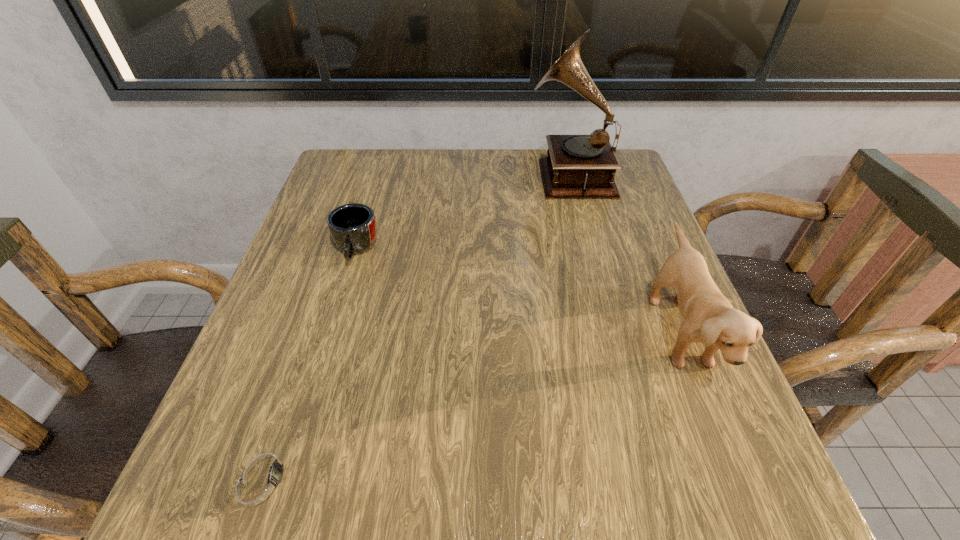
Where is `free space that satisfies the following two spatial constraints: 1. on the side of the mug with the handle; 2. on the face of the shortest object`? free space that satisfies the following two spatial constraints: 1. on the side of the mug with the handle; 2. on the face of the shortest object is located at coordinates (288, 476).

Where is `blank space that satisfies the following two spatial constraints: 1. on the horn of the record player; 2. on the side of the mug with the handle`? Image resolution: width=960 pixels, height=540 pixels. blank space that satisfies the following two spatial constraints: 1. on the horn of the record player; 2. on the side of the mug with the handle is located at coordinates (589, 250).

Identify the location of vacant space that satisfies the following two spatial constraints: 1. on the horn of the record player; 2. on the side of the mug with the handle. (589, 250).

The image size is (960, 540). Find the location of `free spot that satisfies the following two spatial constraints: 1. on the horn of the record player; 2. on the side of the second shortest object with the handle`. free spot that satisfies the following two spatial constraints: 1. on the horn of the record player; 2. on the side of the second shortest object with the handle is located at coordinates (589, 250).

Identify the location of free space that satisfies the following two spatial constraints: 1. on the horn of the tallest object; 2. on the side of the mug with the handle. This screenshot has width=960, height=540. (589, 250).

Where is `free location that satisfies the following two spatial constraints: 1. on the horn of the tallest object; 2. on the side of the mug with the handle`? This screenshot has height=540, width=960. free location that satisfies the following two spatial constraints: 1. on the horn of the tallest object; 2. on the side of the mug with the handle is located at coordinates (589, 250).